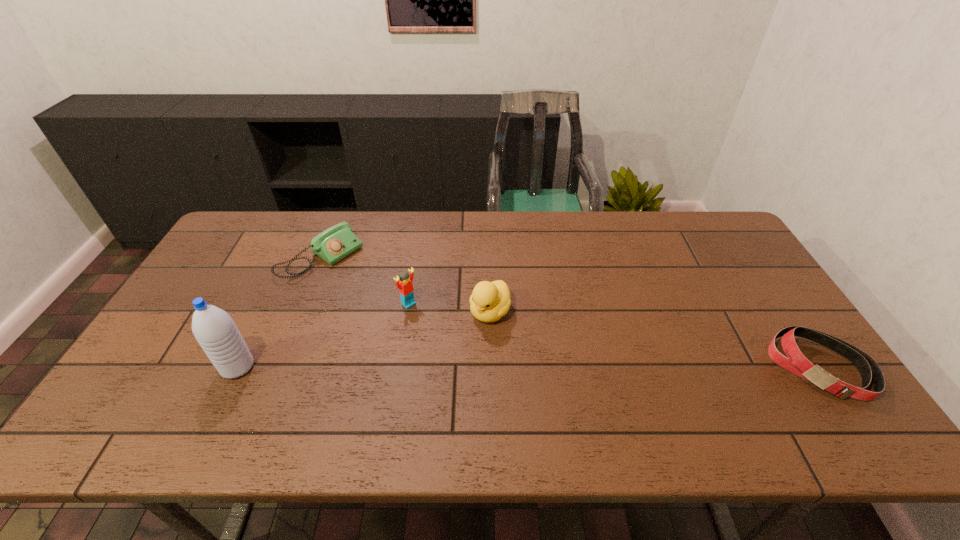
The image size is (960, 540). Find the location of `object that is at the near right corner`. object that is at the near right corner is located at coordinates (795, 362).

Find the location of a particular element. free space at the far edge is located at coordinates (497, 212).

Image resolution: width=960 pixels, height=540 pixels. I want to click on free region at the near edge, so click(x=364, y=397).

This screenshot has height=540, width=960. I want to click on free space at the left edge of the desktop, so click(177, 335).

In the image, there is a desktop. Where is `vacant space at the right edge`? vacant space at the right edge is located at coordinates (699, 256).

You are a GUI agent. You are given a task and a screenshot of the screen. Output one action in this format:
    pyautogui.click(x=<x>, y=<y>)
    Task: Click on the vacant position at the far left corner of the desktop
    This screenshot has width=960, height=540.
    Given the screenshot: What is the action you would take?
    pyautogui.click(x=284, y=220)

Locate an element on the screen. This screenshot has height=540, width=960. blank space at the far right corner of the desktop is located at coordinates (712, 225).

You are a GUI agent. You are given a task and a screenshot of the screen. Output one action in this format:
    pyautogui.click(x=<x>, y=<y>)
    Task: Click on the vacant space that's between the tallest object and the rightmost object
    
    Given the screenshot: What is the action you would take?
    pyautogui.click(x=528, y=367)

The height and width of the screenshot is (540, 960). I want to click on unoccupied area between the tallest object and the telephone, so tap(279, 313).

The image size is (960, 540). Find the location of `free space between the second object from right to left and the third object from right to left`. free space between the second object from right to left and the third object from right to left is located at coordinates (449, 308).